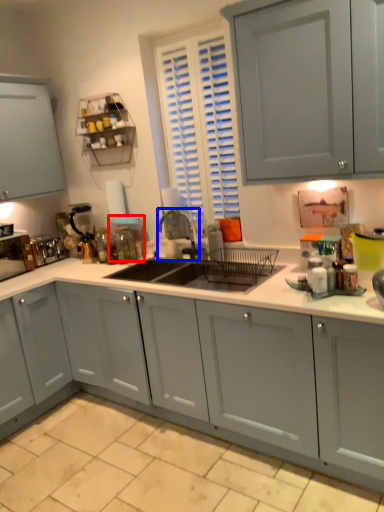
Question: Which of the following is the farthest to the observer, appliance (highlighted by a red box) or faucet (highlighted by a blue box)?

Choices:
 (A) appliance
 (B) faucet

Answer: (A)